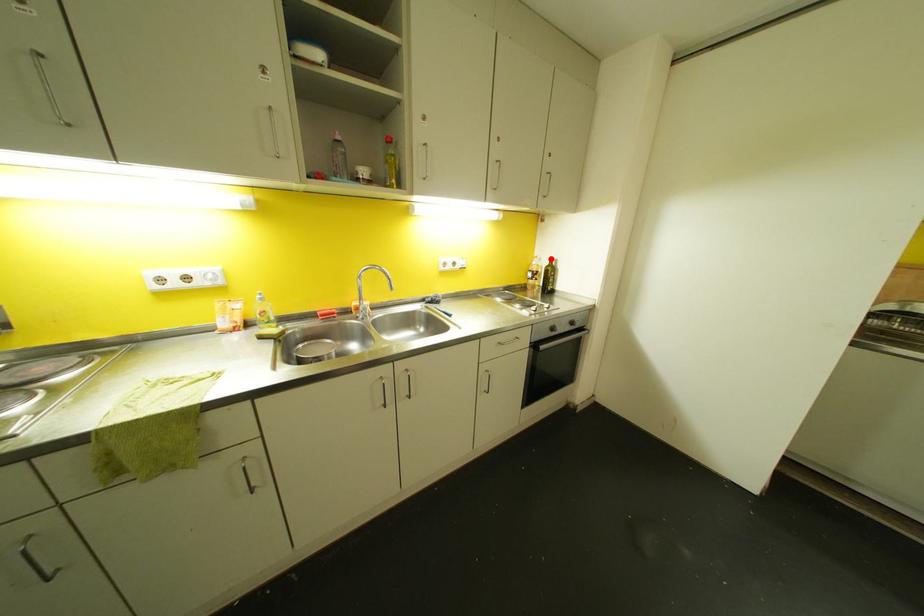
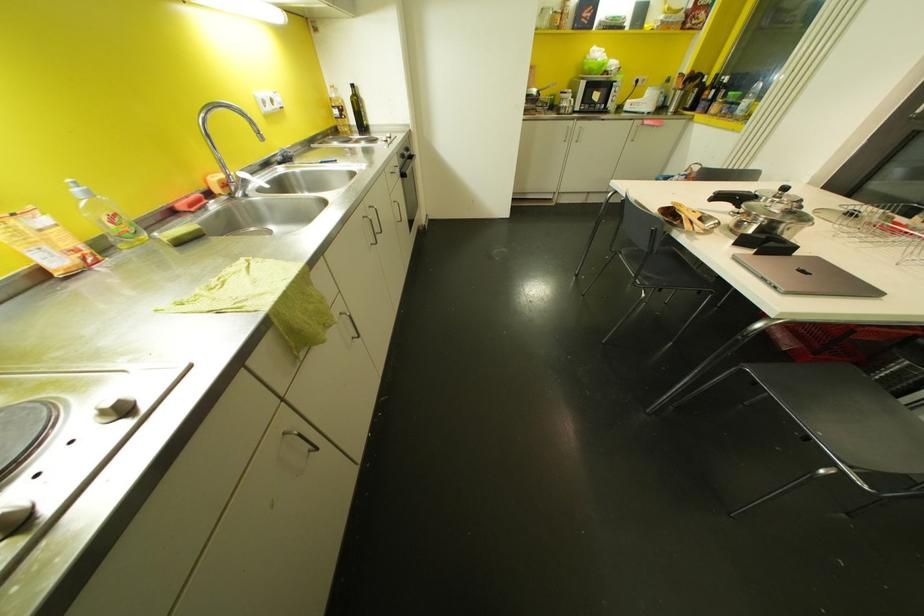
The point at the highlighted location is marked in the first image. Where is the corresponding point in the second image?

(353, 84)